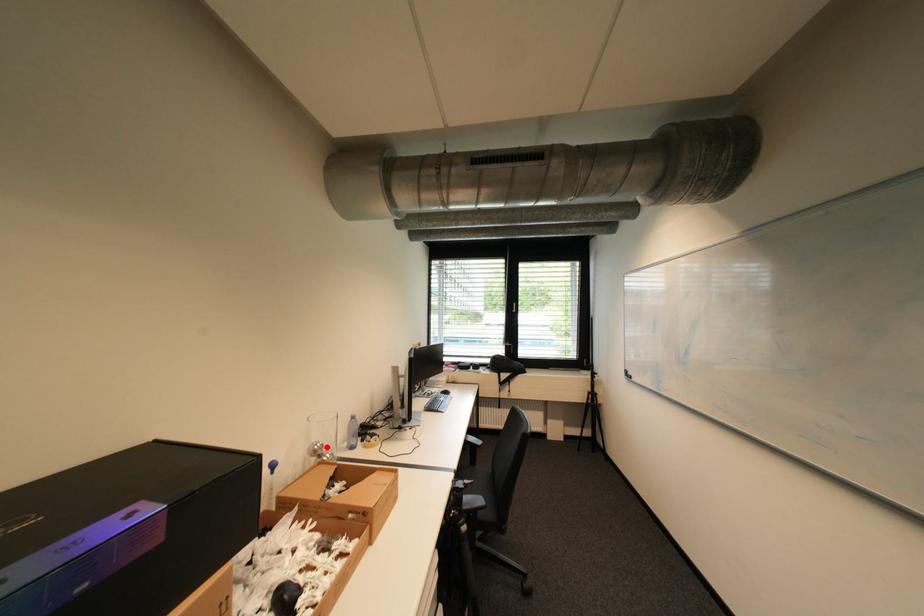
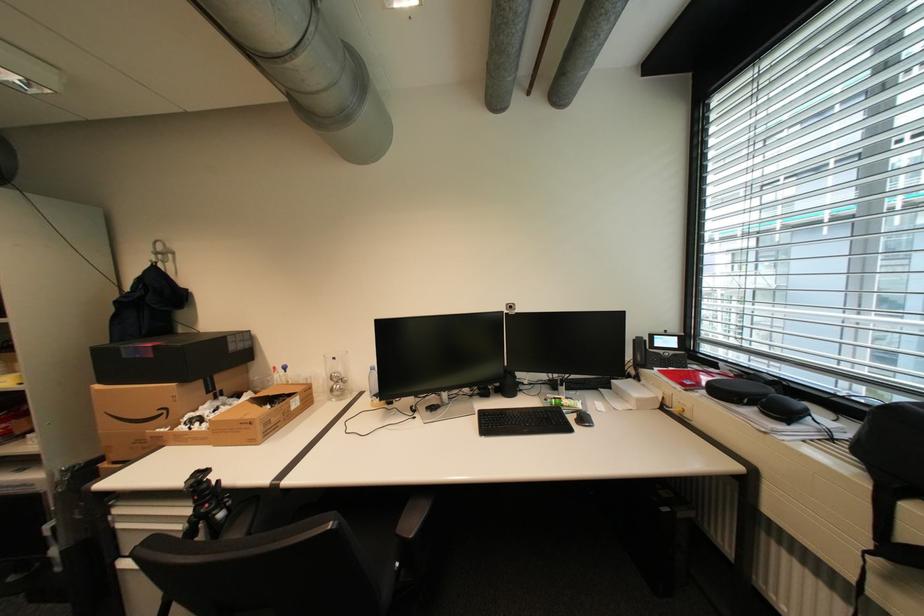
Locate, in the second image, the point that corresponds to the highlighted location in the first image.

(343, 376)